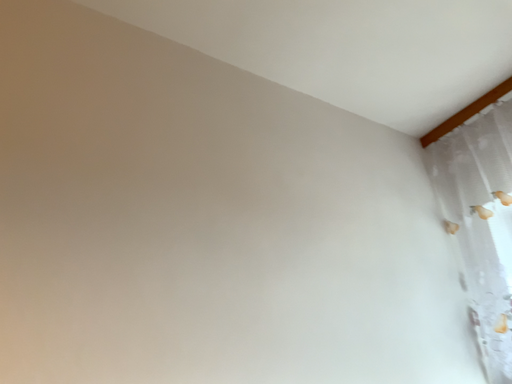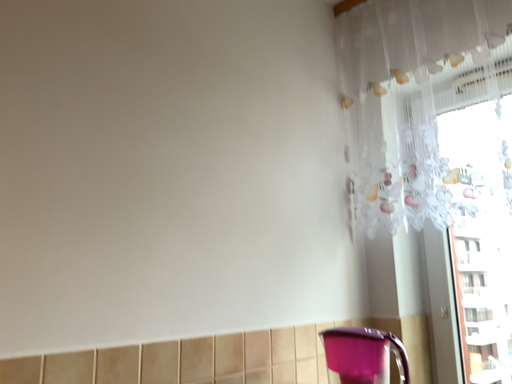
Question: Which way did the camera rotate in the video?

Choices:
 (A) rotated left
 (B) rotated right

Answer: (B)